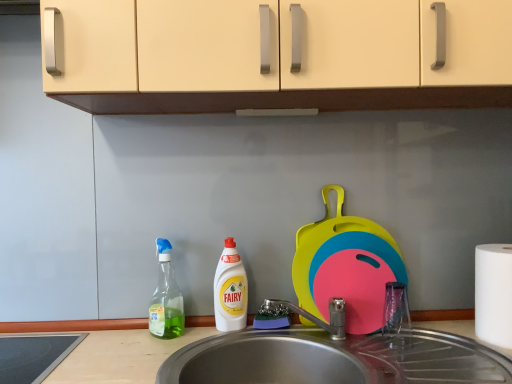
What is the approximate width of metallic stainless steel sink at lower center?

It is 30.38 centimeters.

The image size is (512, 384). Describe the element at coordinates (230, 290) in the screenshot. I see `white plastic bottle at center` at that location.

This screenshot has height=384, width=512. I want to click on metallic stainless steel sink at lower center, so click(113, 350).

Image resolution: width=512 pixels, height=384 pixels. Identify the location of paper towel located in front of the white plastic bottle at center. (493, 294).

Based on the photo, would you say white plastic bottle at center is inside or outside white matte paper towel at right?

white plastic bottle at center lies outside white matte paper towel at right.

Which object is positioned more to the right, white plastic bottle at center or white matte paper towel at right?

white matte paper towel at right is more to the right.

From a real-world perspective, who is located lower, white plastic bottle at center or white matte paper towel at right?

From a 3D spatial view, white matte paper towel at right is below.

At what (x,y) coordinates should I click in order to perform the action: click on countertop that is under the white matte paper towel at right (from a real-world perspective). Please return your answer as a coordinate pair (x, y). This screenshot has width=512, height=384. Looking at the image, I should click on (113, 350).

Would you say metallic stainless steel sink at lower center is to the left or to the right of white matte paper towel at right in the picture?

metallic stainless steel sink at lower center is to the left of white matte paper towel at right.

In terms of width, does metallic stainless steel sink at lower center look wider or thinner when compared to white matte paper towel at right?

metallic stainless steel sink at lower center is wider than white matte paper towel at right.

Is point (149, 376) positioned in front of point (499, 273)?

Yes, point (149, 376) is in front of point (499, 273).

Does transparent plastic spray bottle at left have a lesser width compared to white matte paper towel at right?

Yes, transparent plastic spray bottle at left is thinner than white matte paper towel at right.

Considering their positions, is transparent plastic spray bottle at left located in front of or behind white matte paper towel at right?

In the image, transparent plastic spray bottle at left appears behind white matte paper towel at right.

What's the angular difference between transparent plastic spray bottle at left and white matte paper towel at right's facing directions?

transparent plastic spray bottle at left and white matte paper towel at right are facing 50.1 degrees away from each other.

Is transparent plastic spray bottle at left looking in the opposite direction of white matte paper towel at right?

transparent plastic spray bottle at left does not have its back to white matte paper towel at right.

Which object is closer to the camera, white matte paper towel at right or transparent plastic spray bottle at left?

Positioned in front is white matte paper towel at right.

Considering the relative sizes of white matte paper towel at right and transparent plastic spray bottle at left in the image provided, is white matte paper towel at right bigger than transparent plastic spray bottle at left?

Yes, white matte paper towel at right is bigger than transparent plastic spray bottle at left.

The height and width of the screenshot is (384, 512). Find the location of `bottle on the left of white matte paper towel at right`. bottle on the left of white matte paper towel at right is located at coordinates (166, 298).

Consider the image. From their relative heights in the image, would you say white matte paper towel at right is taller or shorter than transparent plastic spray bottle at left?

In the image, white matte paper towel at right appears to be shorter than transparent plastic spray bottle at left.

Which of these two, white plastic bottle at center or transparent plastic spray bottle at left, is bigger?

transparent plastic spray bottle at left is bigger.

Is white plastic bottle at center far from transparent plastic spray bottle at left?

Actually, white plastic bottle at center and transparent plastic spray bottle at left are a little close together.

Looking at this image, between white plastic bottle at center and transparent plastic spray bottle at left, which one has more height?

transparent plastic spray bottle at left.

Between white plastic bottle at center and transparent plastic spray bottle at left, which one appears on the right side from the viewer's perspective?

white plastic bottle at center is more to the right.

Does transparent plastic spray bottle at left have a greater width compared to white plastic bottle at center?

Yes, transparent plastic spray bottle at left is wider than white plastic bottle at center.

Is transparent plastic spray bottle at left shorter than white plastic bottle at center?

In fact, transparent plastic spray bottle at left may be taller than white plastic bottle at center.

Looking at this image, considering the sizes of objects transparent plastic spray bottle at left and white plastic bottle at center in the image provided, who is smaller, transparent plastic spray bottle at left or white plastic bottle at center?

With smaller size is white plastic bottle at center.

Is transparent plastic spray bottle at left in front of or behind metallic stainless steel sink at lower center in the image?

transparent plastic spray bottle at left is behind metallic stainless steel sink at lower center.

Is transparent plastic spray bottle at left facing towards metallic stainless steel sink at lower center?

No, transparent plastic spray bottle at left is not turned towards metallic stainless steel sink at lower center.

Considering the positions of objects transparent plastic spray bottle at left and metallic stainless steel sink at lower center in the image provided, who is more to the right, transparent plastic spray bottle at left or metallic stainless steel sink at lower center?

Positioned to the right is metallic stainless steel sink at lower center.

Between transparent plastic spray bottle at left and metallic stainless steel sink at lower center, which one has larger width?

Wider between the two is metallic stainless steel sink at lower center.

You are a GUI agent. You are given a task and a screenshot of the screen. Output one action in this format:
    pyautogui.click(x=<x>, y=<y>)
    Task: Click on the paper towel that is on the right side of white plastic bottle at center
    
    Given the screenshot: What is the action you would take?
    pyautogui.click(x=493, y=294)

This screenshot has height=384, width=512. In order to click on countertop in front of the white matte paper towel at right in this screenshot , I will do `click(113, 350)`.

Which object lies nearer to the anchor point metallic stainless steel sink at lower center, transparent plastic spray bottle at left or white matte paper towel at right?

transparent plastic spray bottle at left.

Based on their spatial positions, is transparent plastic spray bottle at left or white matte paper towel at right further from white plastic bottle at center?

white matte paper towel at right.

Based on their spatial positions, is white matte paper towel at right or metallic stainless steel sink at lower center further from transparent plastic spray bottle at left?

Among the two, white matte paper towel at right is located further to transparent plastic spray bottle at left.

Based on their spatial positions, is transparent plastic spray bottle at left or white plastic bottle at center further from metallic stainless steel sink at lower center?

white plastic bottle at center lies further to metallic stainless steel sink at lower center than the other object.

Which object lies nearer to the anchor point white matte paper towel at right, white plastic bottle at center or transparent plastic spray bottle at left?

white plastic bottle at center lies closer to white matte paper towel at right than the other object.

Considering their positions, is white plastic bottle at center positioned further to transparent plastic spray bottle at left than metallic stainless steel sink at lower center?

Among the two, white plastic bottle at center is located further to transparent plastic spray bottle at left.

Which object lies further to the anchor point white matte paper towel at right, transparent plastic spray bottle at left or metallic stainless steel sink at lower center?

transparent plastic spray bottle at left is positioned further to the anchor white matte paper towel at right.

Based on their spatial positions, is transparent plastic spray bottle at left or white plastic bottle at center further from white matte paper towel at right?

The object further to white matte paper towel at right is transparent plastic spray bottle at left.

The height and width of the screenshot is (384, 512). I want to click on cleaning product between transparent plastic spray bottle at left and metallic stainless steel sink at lower center from left to right, so click(x=230, y=290).

Where is `countertop situated between transparent plastic spray bottle at left and white matte paper towel at right from left to right`? This screenshot has width=512, height=384. countertop situated between transparent plastic spray bottle at left and white matte paper towel at right from left to right is located at coordinates (113, 350).

At what (x,y) coordinates should I click in order to perform the action: click on cleaning product located between transparent plastic spray bottle at left and white matte paper towel at right in the left-right direction. Please return your answer as a coordinate pair (x, y). The width and height of the screenshot is (512, 384). Looking at the image, I should click on (230, 290).

At what (x,y) coordinates should I click in order to perform the action: click on countertop between white plastic bottle at center and white matte paper towel at right from left to right. Please return your answer as a coordinate pair (x, y). The image size is (512, 384). Looking at the image, I should click on (113, 350).